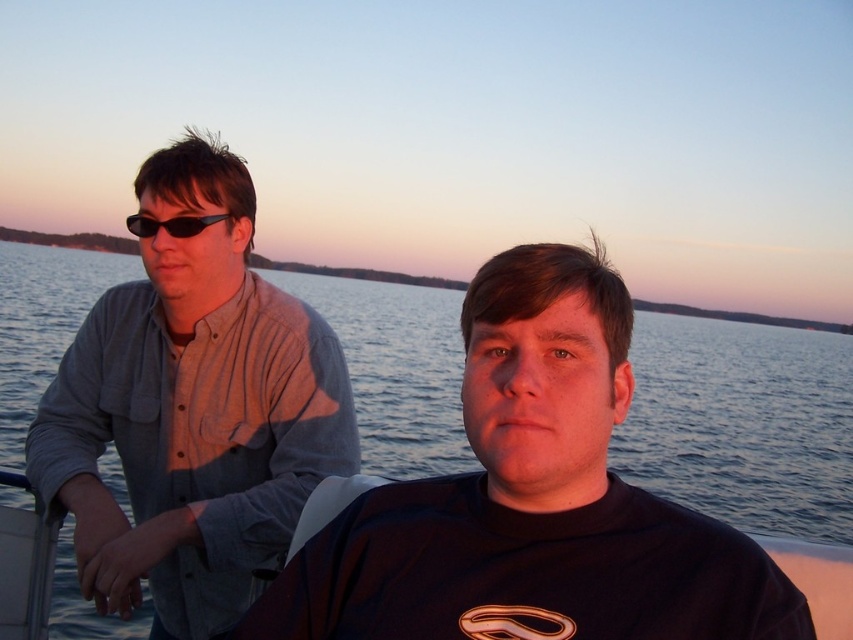
You are a photographer trying to capture a closeup of the matte gray shirt at left and the black plastic sunglasses at upper left. Which object should you focus on first if you want to ensure both are in sharp focus?

The matte gray shirt at left is positioned on the left side of black plastic sunglasses at upper left. Since they are close to each other, focusing on the matte gray shirt at left first would help ensure both are in focus as they are in the same focal plane.

You are a photographer trying to capture a clear shot of the matte gray shirt at left and the black plastic sunglasses at upper left. Which object should you focus on first to ensure both are in focus?

You should focus on the matte gray shirt at left first because it is closer to the viewer than the black plastic sunglasses at upper left, so adjusting focus from near to far will help both objects be in focus.